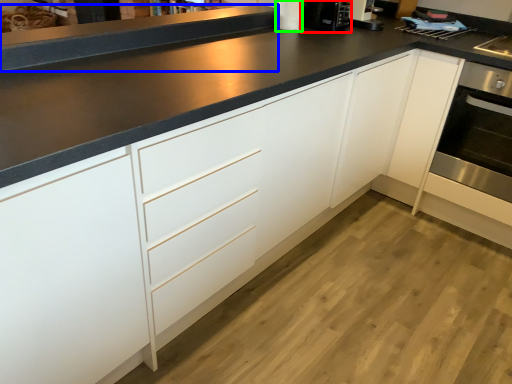
Question: Which object is the closest to the coffee machine (highlighted by a red box)? Choose among these: counter top (highlighted by a blue box) or appliance (highlighted by a green box).

Choices:
 (A) counter top
 (B) appliance

Answer: (B)